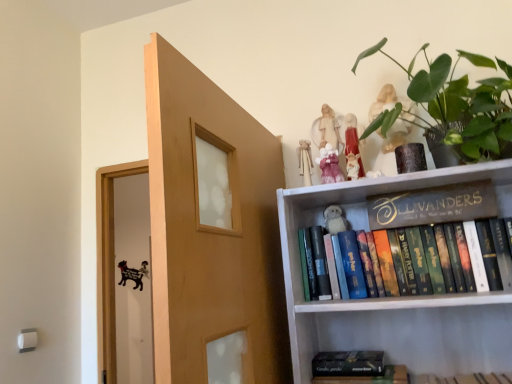
Question: Considering the relative sizes of hardcover books at upper right, which is the 2th book in bottom-to-top order, and matte pink figurine at upper center, which ranks as the 1th toy in front-to-back order, in the image provided, is hardcover books at upper right, which is the 2th book in bottom-to-top order, smaller than matte pink figurine at upper center, which ranks as the 1th toy in front-to-back order,?

Choices:
 (A) no
 (B) yes

Answer: (A)

Question: Is hardcover books at upper right, which is the 2th book in bottom-to-top order, positioned before matte pink figurine at upper center, the fourth toy in the back-to-front sequence?

Choices:
 (A) yes
 (B) no

Answer: (A)

Question: From the image's perspective, is hardcover books at upper right, which is the 2th book in bottom-to-top order, on top of matte pink figurine at upper center, which ranks as the 1th toy in front-to-back order?

Choices:
 (A) no
 (B) yes

Answer: (A)

Question: Considering the relative positions of hardcover books at upper right, which is the 2th book in bottom-to-top order, and matte pink figurine at upper center, the fourth toy in the back-to-front sequence, in the image provided, is hardcover books at upper right, which is the 2th book in bottom-to-top order, to the right of matte pink figurine at upper center, the fourth toy in the back-to-front sequence, from the viewer's perspective?

Choices:
 (A) yes
 (B) no

Answer: (A)

Question: Would you consider hardcover books at upper right, which is the 2th book in bottom-to-top order, to be distant from matte pink figurine at upper center, which ranks as the 1th toy in front-to-back order?

Choices:
 (A) yes
 (B) no

Answer: (B)

Question: Is hardcover books at upper right, which is the 2th book in bottom-to-top order, positioned with its back to matte pink figurine at upper center, the fourth toy in the back-to-front sequence?

Choices:
 (A) yes
 (B) no

Answer: (B)

Question: Does pink fabric doll at upper center, which appears as the third toy when viewed from the back, have a greater height compared to matte pink figurine at upper center, which ranks as the 1th toy in front-to-back order?

Choices:
 (A) yes
 (B) no

Answer: (A)

Question: Is pink fabric doll at upper center, the second toy when ordered from front to back, facing away from matte pink figurine at upper center, which ranks as the 1th toy in front-to-back order?

Choices:
 (A) yes
 (B) no

Answer: (B)

Question: Does pink fabric doll at upper center, which appears as the third toy when viewed from the back, lie in front of matte pink figurine at upper center, which ranks as the 1th toy in front-to-back order?

Choices:
 (A) yes
 (B) no

Answer: (B)

Question: Is pink fabric doll at upper center, which appears as the third toy when viewed from the back, not near matte pink figurine at upper center, which ranks as the 1th toy in front-to-back order?

Choices:
 (A) yes
 (B) no

Answer: (B)

Question: Is pink fabric doll at upper center, which appears as the third toy when viewed from the back, shorter than matte pink figurine at upper center, the fourth toy in the back-to-front sequence?

Choices:
 (A) yes
 (B) no

Answer: (B)

Question: Can you confirm if pink fabric doll at upper center, which appears as the third toy when viewed from the back, is wider than matte pink figurine at upper center, which ranks as the 1th toy in front-to-back order?

Choices:
 (A) yes
 (B) no

Answer: (B)

Question: Can you confirm if white plush toy at upper center, acting as the 4th toy starting from the front, is shorter than pink fabric doll at upper center, which appears as the third toy when viewed from the back?

Choices:
 (A) yes
 (B) no

Answer: (A)